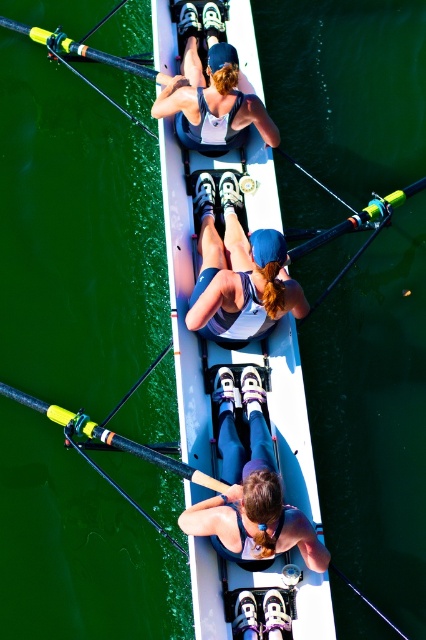
Question: Can you confirm if matte purple leggings at center is positioned below matte blue tank top at upper center?

Choices:
 (A) yes
 (B) no

Answer: (A)

Question: Which point is closer to the camera?

Choices:
 (A) (290, 513)
 (B) (222, 77)
 (C) (207, 486)

Answer: (A)

Question: Among these objects, which one is farthest from the camera?

Choices:
 (A) matte blue tank top at upper center
 (B) matte blue tank top at center
 (C) matte purple leggings at center
 (D) white glossy boat at center

Answer: (A)

Question: Which of the following is the farthest from the observer?

Choices:
 (A) white glossy boat at center
 (B) matte blue tank top at upper center
 (C) black rubber oar at center

Answer: (B)

Question: Is white glossy boat at center wider than matte blue tank top at upper center?

Choices:
 (A) yes
 (B) no

Answer: (A)

Question: Does matte purple leggings at center have a lesser width compared to black rubber oar at center?

Choices:
 (A) no
 (B) yes

Answer: (B)